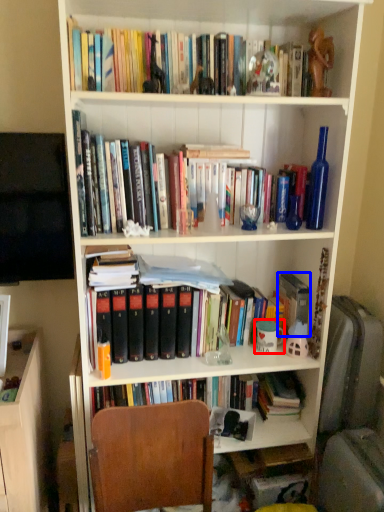
Question: Which point is further to the camera, coffee cup (highlighted by a red box) or paperback book (highlighted by a blue box)?

Choices:
 (A) coffee cup
 (B) paperback book

Answer: (B)